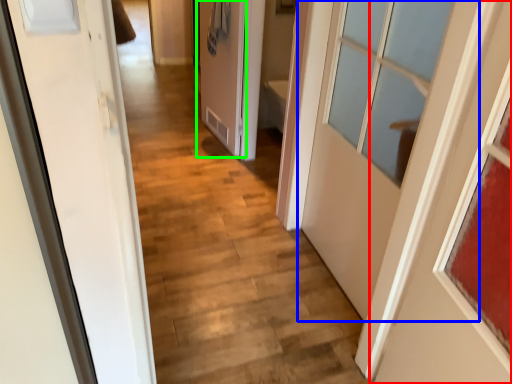
Question: Based on their relative distances, which object is farther from door (highlighted by a red box)? Choose from door (highlighted by a blue box) and door (highlighted by a green box).

Choices:
 (A) door
 (B) door

Answer: (B)